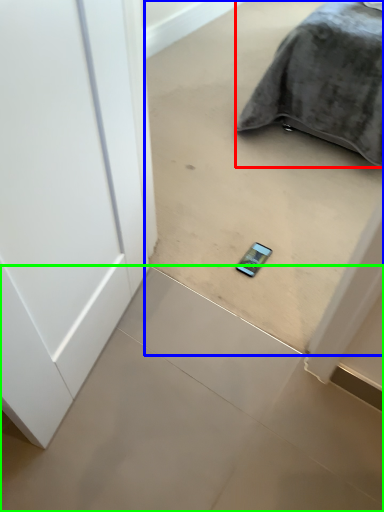
Question: Based on their relative distances, which object is nearer to furniture (highlighted by a red box)? Choose from concrete (highlighted by a blue box) and concrete (highlighted by a green box).

Choices:
 (A) concrete
 (B) concrete

Answer: (A)